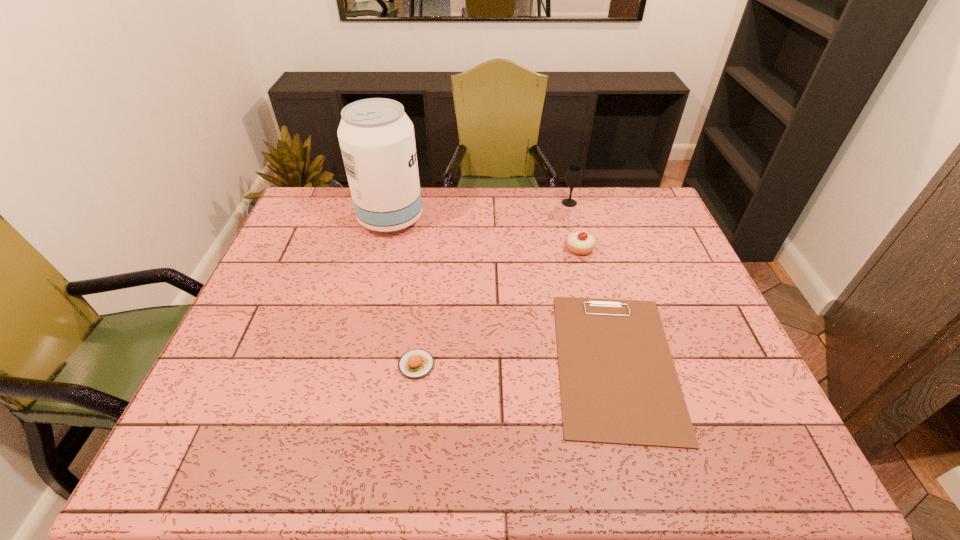
Identify which object is the second nearest to the food. Please provide its 2D coordinates. Your answer should be formatted as a tuple, i.e. [(x, y)], where the tuple contains the x and y coordinates of a point satisfying the conditions above.

[(376, 137)]

Point out which object is positioned as the third nearest to the tallest object. Please provide its 2D coordinates. Your answer should be formatted as a tuple, i.e. [(x, y)], where the tuple contains the x and y coordinates of a point satisfying the conditions above.

[(578, 242)]

Where is `vacant region that satisfies the following two spatial constraints: 1. on the front side of the fourth tallest object; 2. on the left side of the alcohol`? The width and height of the screenshot is (960, 540). vacant region that satisfies the following two spatial constraints: 1. on the front side of the fourth tallest object; 2. on the left side of the alcohol is located at coordinates (356, 364).

Where is `vacant region that satisfies the following two spatial constraints: 1. on the front side of the tallest object; 2. on the right side of the shortest object`? Image resolution: width=960 pixels, height=540 pixels. vacant region that satisfies the following two spatial constraints: 1. on the front side of the tallest object; 2. on the right side of the shortest object is located at coordinates (356, 363).